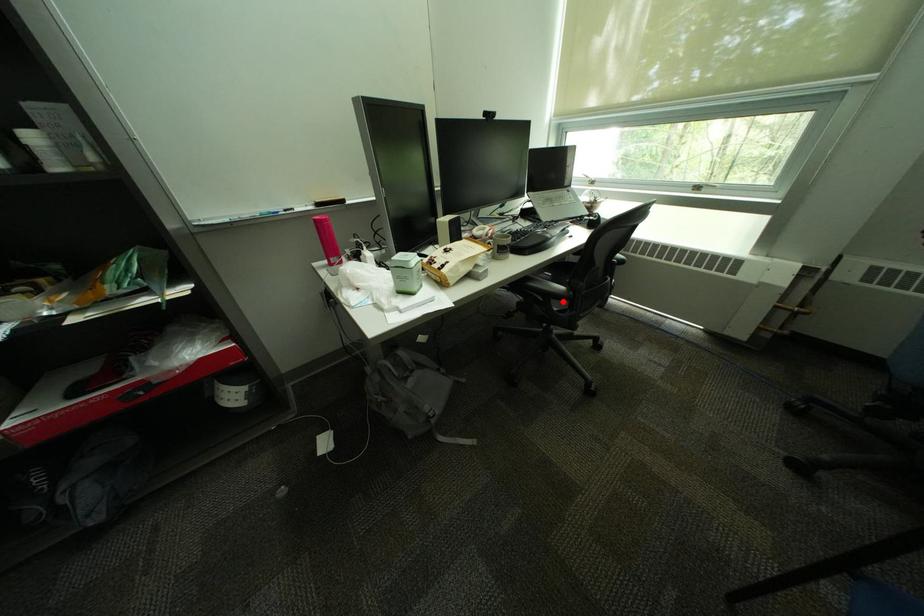
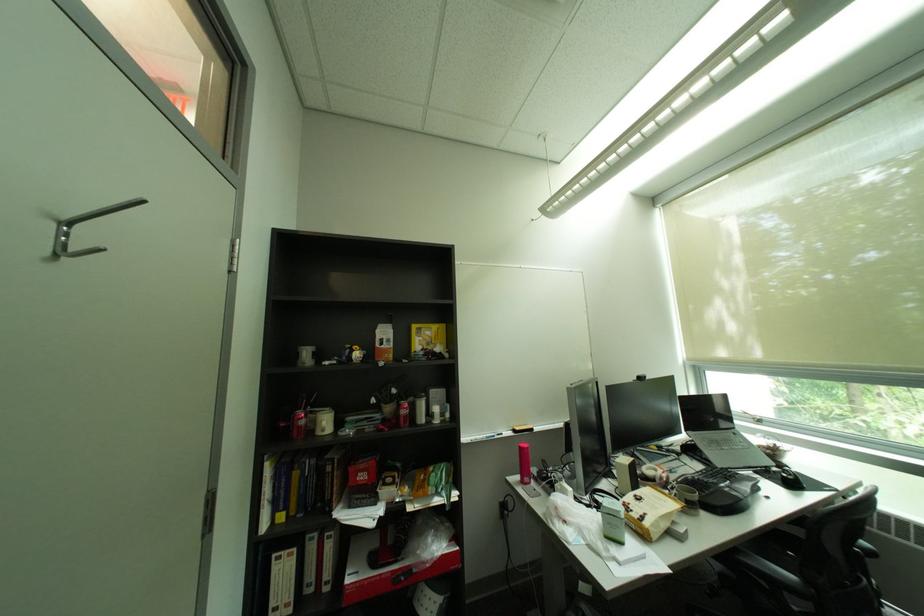
Find the pixel in the second image that matches the highlighted location in the first image.

(796, 594)